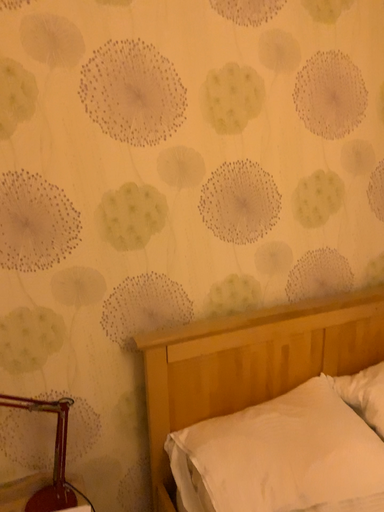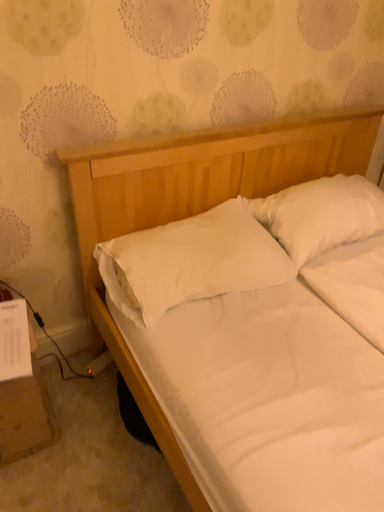
Question: Which way did the camera rotate in the video?

Choices:
 (A) rotated upward
 (B) rotated downward

Answer: (B)